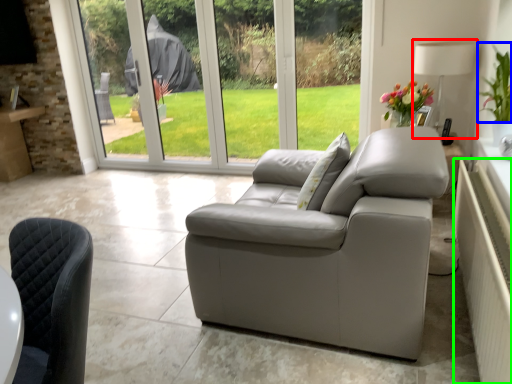
Question: Estimate the real-world distances between objects in this image. Which object is farther from lamp (highlighted by a red box), plant (highlighted by a blue box) or radiator (highlighted by a green box)?

Choices:
 (A) plant
 (B) radiator

Answer: (B)